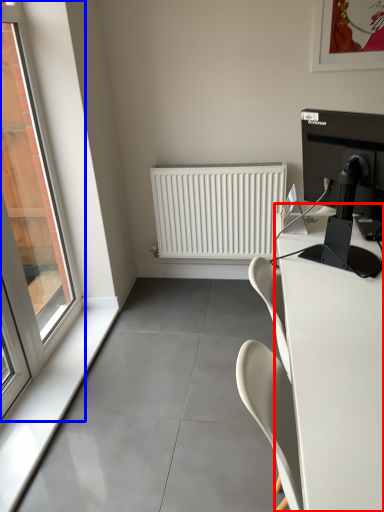
Question: Among these objects, which one is nearest to the camera, desk (highlighted by a red box) or window (highlighted by a blue box)?

Choices:
 (A) desk
 (B) window

Answer: (A)